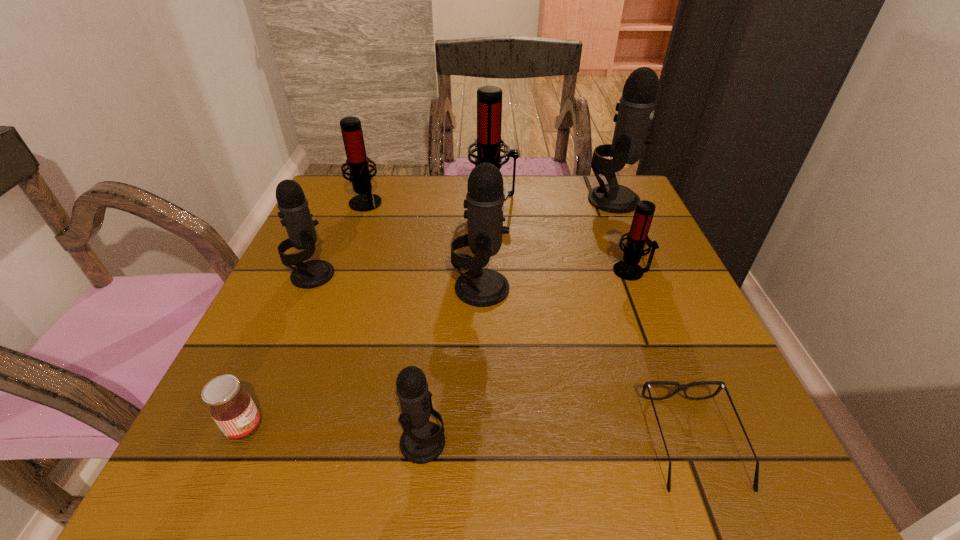
I want to click on microphone positioned at the near edge, so 422,441.

Where is `jam at the near edge`? The width and height of the screenshot is (960, 540). jam at the near edge is located at coordinates (x=231, y=407).

The height and width of the screenshot is (540, 960). Find the location of `spectacles that is at the near edge`. spectacles that is at the near edge is located at coordinates (681, 387).

You are a GUI agent. You are given a task and a screenshot of the screen. Output one action in this format:
    pyautogui.click(x=<x>, y=<y>)
    Task: Click on the jam situated at the left edge
    This screenshot has width=960, height=540.
    Given the screenshot: What is the action you would take?
    pyautogui.click(x=231, y=407)

At what (x,y) coordinates should I click in order to perform the action: click on spectacles that is positioned at the right edge. Please return your answer as a coordinate pair (x, y). The height and width of the screenshot is (540, 960). Looking at the image, I should click on (681, 387).

Locate an element on the screen. object that is positioned at the far left corner is located at coordinates (357, 161).

Image resolution: width=960 pixels, height=540 pixels. I want to click on object that is at the near left corner, so click(x=231, y=407).

The height and width of the screenshot is (540, 960). In order to click on object that is at the far right corner in this screenshot , I will do `click(636, 108)`.

At what (x,y) coordinates should I click in order to perform the action: click on object located at the near right corner. Please return your answer as a coordinate pair (x, y). The width and height of the screenshot is (960, 540). Looking at the image, I should click on (681, 387).

Find the location of a particular element. free region at the far edge of the desktop is located at coordinates (416, 199).